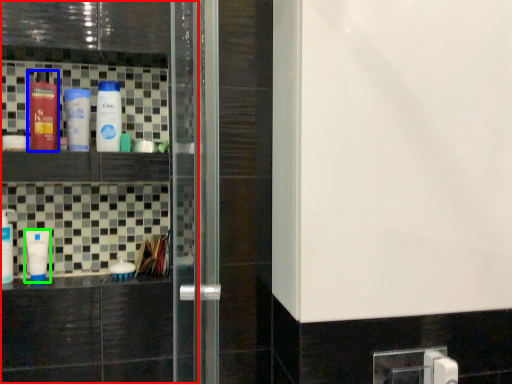
Question: Which object is the farthest from screen door (highlighted by a red box)? Choose among these: bottle (highlighted by a blue box) or bottle (highlighted by a green box).

Choices:
 (A) bottle
 (B) bottle

Answer: (A)